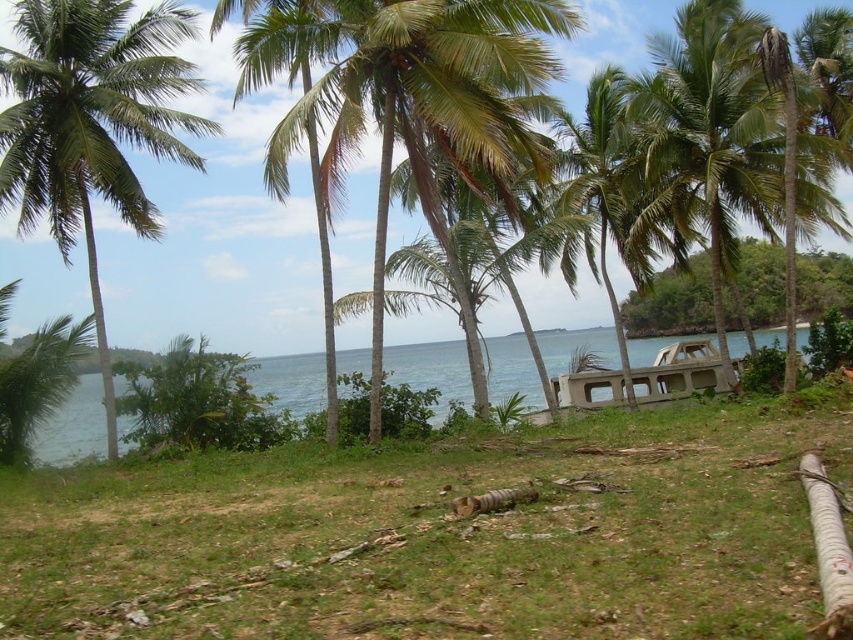
Is green leafy palm tree at center to the right of green leafy palm tree at left from the viewer's perspective?

Yes, green leafy palm tree at center is to the right of green leafy palm tree at left.

What do you see at coordinates (409, 106) in the screenshot? I see `green leafy palm tree at center` at bounding box center [409, 106].

Does point (540, 6) lie in front of point (53, 97)?

Yes, it is in front of point (53, 97).

The width and height of the screenshot is (853, 640). In order to click on green leafy palm tree at center in this screenshot , I will do `click(409, 106)`.

Which is below, green leafy palm tree at right or blue water at center?

blue water at center

Find the location of a particular element. green leafy palm tree at right is located at coordinates (708, 132).

You are a GUI agent. You are given a task and a screenshot of the screen. Output one action in this format:
    pyautogui.click(x=<x>, y=<y>)
    Task: Click on the green leafy palm tree at right
    The image size is (853, 640).
    Given the screenshot: What is the action you would take?
    pyautogui.click(x=708, y=132)

Which is below, green leafy coconut tree at center or green leafy palm tree at center?

green leafy palm tree at center is lower down.

Can you confirm if green leafy coconut tree at center is positioned to the right of green leafy palm tree at center?

Yes, green leafy coconut tree at center is to the right of green leafy palm tree at center.

Image resolution: width=853 pixels, height=640 pixels. What do you see at coordinates (218, 230) in the screenshot?
I see `green leafy coconut tree at center` at bounding box center [218, 230].

The width and height of the screenshot is (853, 640). I want to click on green leafy coconut tree at center, so click(218, 230).